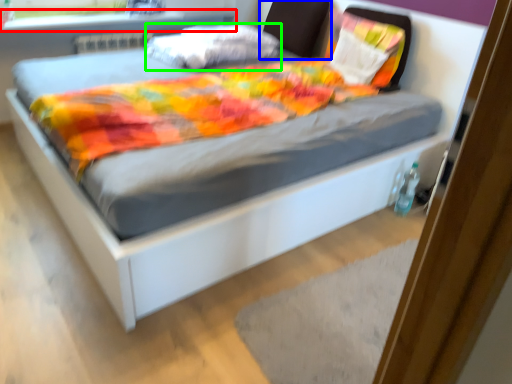
Question: Which object is positioned farthest from window sill (highlighted by a red box)? Select from headboard (highlighted by a blue box) and pillow (highlighted by a green box).

Choices:
 (A) headboard
 (B) pillow

Answer: (A)